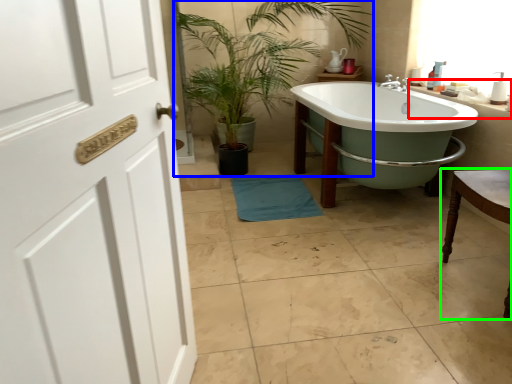
Question: Considering the real-world distances, which object is farthest from counter top (highlighted by a red box)? houseplant (highlighted by a blue box) or chair (highlighted by a green box)?

Choices:
 (A) houseplant
 (B) chair

Answer: (A)